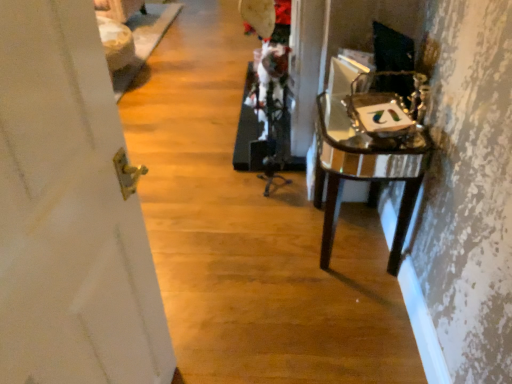
Find the location of a particular element. vacant space in front of glossy glass table at right is located at coordinates (342, 313).